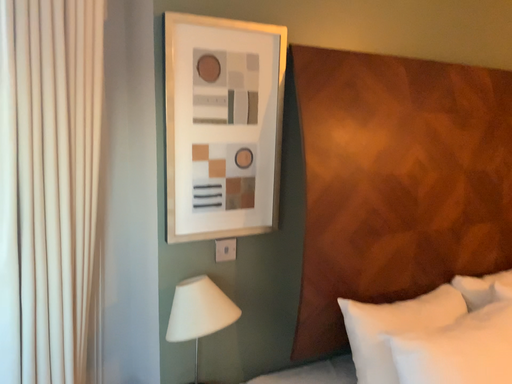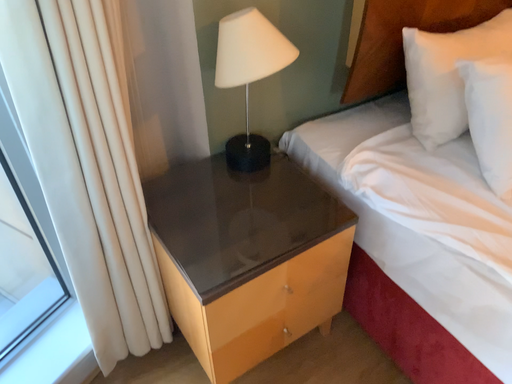
Question: How did the camera likely rotate when shooting the video?

Choices:
 (A) rotated upward
 (B) rotated downward

Answer: (B)